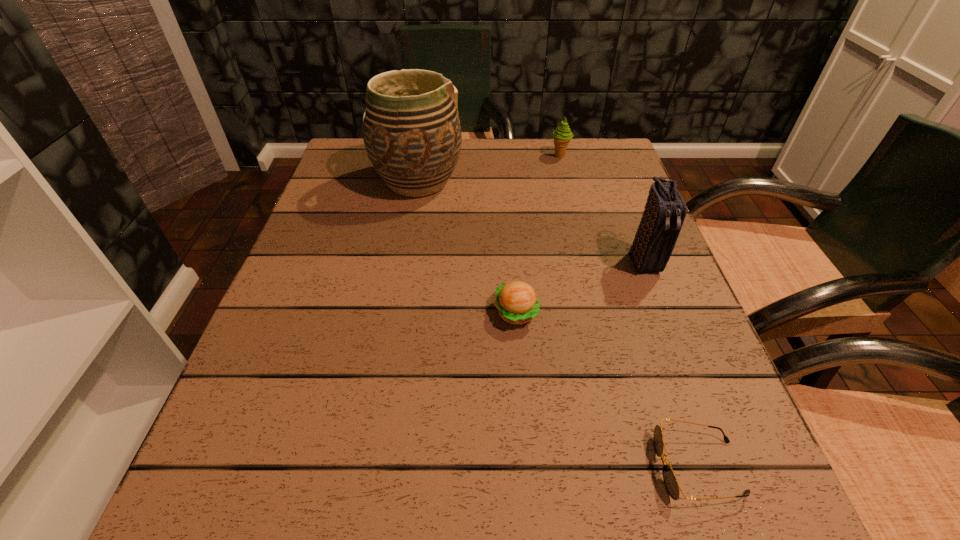
Locate an element on the screen. The height and width of the screenshot is (540, 960). the tallest object is located at coordinates (411, 129).

This screenshot has width=960, height=540. What are the coordinates of `the leftmost object` in the screenshot? It's located at (411, 129).

Identify the location of the third farthest object. The image size is (960, 540). (665, 210).

At what (x,y) coordinates should I click in order to perform the action: click on clutch bag. Please return your answer as a coordinate pair (x, y). Image resolution: width=960 pixels, height=540 pixels. Looking at the image, I should click on (665, 210).

The height and width of the screenshot is (540, 960). I want to click on icecream, so click(x=562, y=135).

Where is `hamburger`? hamburger is located at coordinates (516, 301).

I want to click on the second nearest object, so click(x=516, y=301).

At what (x,y) coordinates should I click in order to perform the action: click on the shortest object. Please return your answer as a coordinate pair (x, y). Image resolution: width=960 pixels, height=540 pixels. Looking at the image, I should click on (670, 481).

Locate an element on the screen. the nearest object is located at coordinates (670, 481).

Identify the location of free space located on the front of the pottery. This screenshot has width=960, height=540. (406, 247).